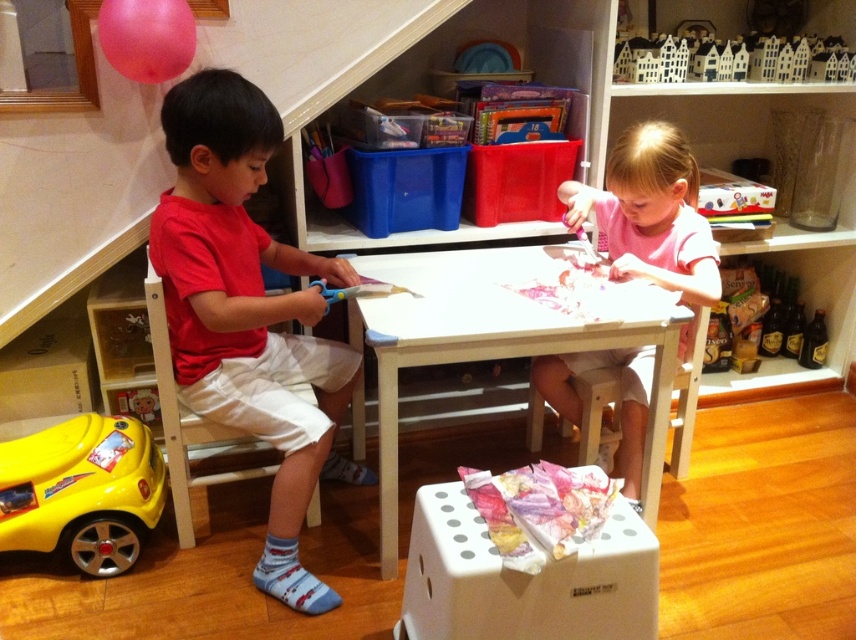
Can you confirm if red matte shirt at left is taller than pink cotton shirt at center?

Yes.

Based on the photo, does red matte shirt at left have a larger size compared to pink cotton shirt at center?

Correct, red matte shirt at left is larger in size than pink cotton shirt at center.

You are a GUI agent. You are given a task and a screenshot of the screen. Output one action in this format:
    pyautogui.click(x=<x>, y=<y>)
    Task: Click on the red matte shirt at left
    The width and height of the screenshot is (856, 640).
    Given the screenshot: What is the action you would take?
    pyautogui.click(x=248, y=312)

Where is `red matte shirt at left`? Image resolution: width=856 pixels, height=640 pixels. red matte shirt at left is located at coordinates (248, 312).

Does yellow plastic toy car at lower left have a greater height compared to white matte wooden houses at upper center?

Correct, yellow plastic toy car at lower left is much taller as white matte wooden houses at upper center.

Between yellow plastic toy car at lower left and white matte wooden houses at upper center, which one appears on the left side from the viewer's perspective?

Positioned to the left is yellow plastic toy car at lower left.

Who is more distant from viewer, [13,506] or [649,64]?

Positioned behind is point [649,64].

Where is `yellow plastic toy car at lower left`? yellow plastic toy car at lower left is located at coordinates (82, 490).

Is white wooden table at center taller than pink cotton shirt at center?

In fact, white wooden table at center may be shorter than pink cotton shirt at center.

Between point (510, 314) and point (619, 179), which one is positioned in front?

Point (510, 314) is more forward.

What do you see at coordinates (500, 348) in the screenshot?
I see `white wooden table at center` at bounding box center [500, 348].

At what (x,y) coordinates should I click in order to perform the action: click on white wooden table at center. Please return your answer as a coordinate pair (x, y). Looking at the image, I should click on (500, 348).